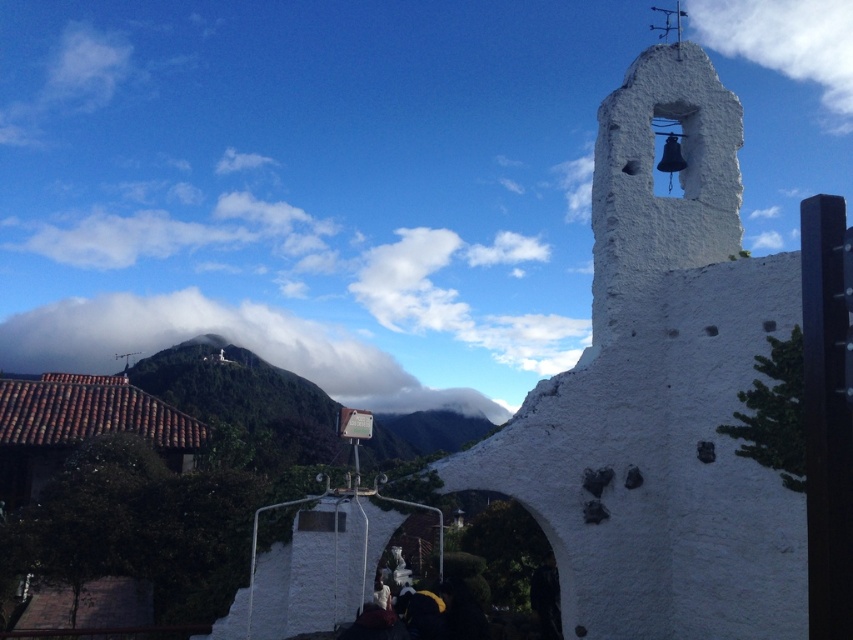
You are standing at the base of the bell tower and want to take a photo of the white fluffy cloud at upper left. Based on its coordinates, where should you aim your camera?

The white fluffy cloud at upper left is located at coordinates point (225, 339), so you should aim your camera towards the upper left area of the scene to capture it.

Looking at this image, you are standing in front of the bell tower and want to take a photo. There are two points marked on the tower, one at coordinates point [125,298] and another at point [827,92]. Which point is closer to your camera when taking the photo?

Point [125,298] is closer to the camera than point [827,92].